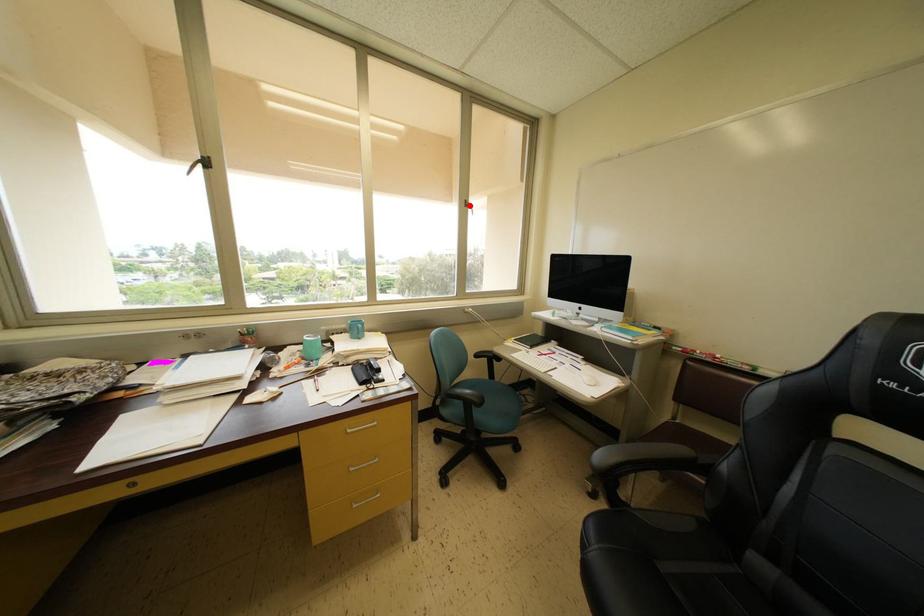
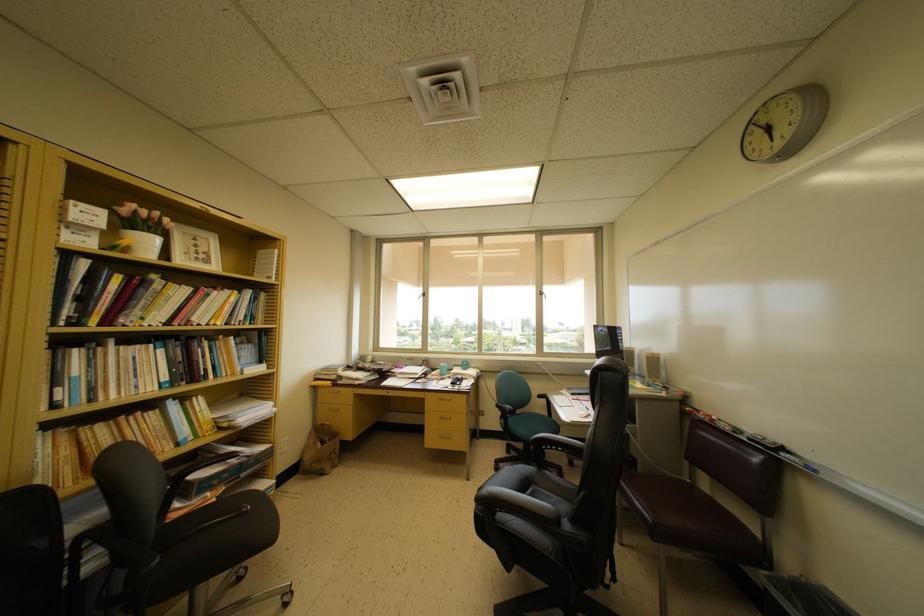
Where in the second image is the point corresponding to the highlighted location from the first image?

(543, 297)